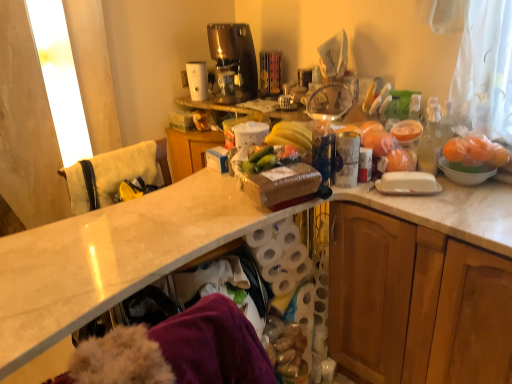
Question: Considering the positions of orange matte fruit at right and white glossy mixing bowl at right in the image, is orange matte fruit at right wider or thinner than white glossy mixing bowl at right?

Choices:
 (A) wide
 (B) thin

Answer: (B)

Question: Is point (490, 152) positioned closer to the camera than point (490, 173)?

Choices:
 (A) farther
 (B) closer

Answer: (B)

Question: Estimate the real-world distances between objects in this image. Which object is closer to the clear plastic bottle at right?

Choices:
 (A) white marble countertop at center
 (B) green matte cucumber at center
 (C) white plastic coffee maker at upper center, which is counted as the second appliance, starting from the right
 (D) transparent glass bowl at upper center, the 1th appliance viewed from the front
 (E) wooden cabinet at right

Answer: (D)

Question: Which of these objects is positioned farthest from the orange matte fruit at right?

Choices:
 (A) white glossy mixing bowl at right
 (B) white towel at left
 (C) clear plastic bottle at right
 (D) white plastic coffee maker at upper center, marked as the first appliance in a back-to-front arrangement
 (E) green matte cucumber at center

Answer: (D)